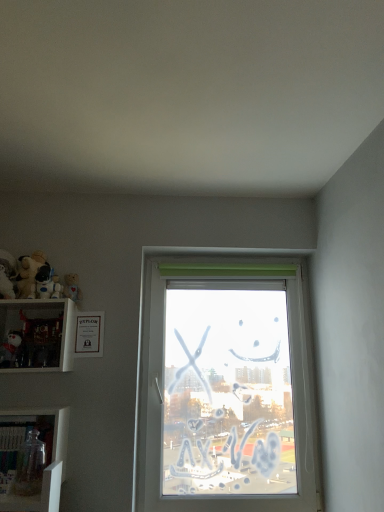
Question: Considering the relative sizes of transparent glass jar at lower left, the 1th toy from the bottom, and matte white plush at left, acting as the 2th toy starting from the bottom, in the image provided, is transparent glass jar at lower left, the 1th toy from the bottom, shorter than matte white plush at left, acting as the 2th toy starting from the bottom,?

Choices:
 (A) yes
 (B) no

Answer: (B)

Question: Is transparent glass jar at lower left, the 1th toy from the bottom, to the right of matte white plush at left, placed as the 4th toy when sorted from top to bottom, from the viewer's perspective?

Choices:
 (A) yes
 (B) no

Answer: (A)

Question: Is transparent glass jar at lower left, the fifth toy from the top, thinner than matte white plush at left, acting as the 2th toy starting from the bottom?

Choices:
 (A) no
 (B) yes

Answer: (A)

Question: Considering the relative sizes of transparent glass jar at lower left, the 1th toy from the bottom, and matte white plush at left, acting as the 2th toy starting from the bottom, in the image provided, is transparent glass jar at lower left, the 1th toy from the bottom, wider than matte white plush at left, acting as the 2th toy starting from the bottom,?

Choices:
 (A) yes
 (B) no

Answer: (A)

Question: From the image's perspective, is transparent glass jar at lower left, the fifth toy from the top, located above matte white plush at left, acting as the 2th toy starting from the bottom?

Choices:
 (A) no
 (B) yes

Answer: (A)

Question: Looking at the image, does clear glass jar at lower left, the second shelf viewed from the top, seem bigger or smaller compared to fluffy beige teddy bear at left, the 1th toy in the top-to-bottom sequence?

Choices:
 (A) small
 (B) big

Answer: (B)

Question: Choose the correct answer: Is clear glass jar at lower left, the second shelf viewed from the top, inside fluffy beige teddy bear at left, the 1th toy in the top-to-bottom sequence, or outside it?

Choices:
 (A) outside
 (B) inside

Answer: (A)

Question: From the image's perspective, relative to fluffy beige teddy bear at left, the 1th toy in the top-to-bottom sequence, is clear glass jar at lower left, the second shelf viewed from the top, above or below?

Choices:
 (A) above
 (B) below

Answer: (B)

Question: From a real-world perspective, is clear glass jar at lower left, acting as the 1th shelf starting from the bottom, physically located above or below fluffy beige teddy bear at left, the 1th toy in the top-to-bottom sequence?

Choices:
 (A) above
 (B) below

Answer: (B)

Question: Based on their positions, is transparent glass jar at lower left, the fifth toy from the top, located to the left or right of clear glass jar at lower left, the second shelf viewed from the top?

Choices:
 (A) right
 (B) left

Answer: (A)

Question: Based on their sizes in the image, would you say transparent glass jar at lower left, the fifth toy from the top, is bigger or smaller than clear glass jar at lower left, the second shelf viewed from the top?

Choices:
 (A) big
 (B) small

Answer: (B)

Question: From a real-world perspective, is transparent glass jar at lower left, the 1th toy from the bottom, above or below clear glass jar at lower left, the second shelf viewed from the top?

Choices:
 (A) below
 (B) above

Answer: (A)

Question: From the image's perspective, relative to clear glass jar at lower left, the second shelf viewed from the top, is transparent glass jar at lower left, the fifth toy from the top, above or below?

Choices:
 (A) below
 (B) above

Answer: (A)

Question: From the image's perspective, is soft plush bear at upper left, which is the 4th toy in bottom-to-top order, positioned above or below white glossy shelf at left, the second shelf when ordered from bottom to top?

Choices:
 (A) above
 (B) below

Answer: (A)

Question: Is soft plush bear at upper left, the 2th toy in the top-to-bottom sequence, in front of or behind white glossy shelf at left, the second shelf when ordered from bottom to top, in the image?

Choices:
 (A) behind
 (B) front

Answer: (A)